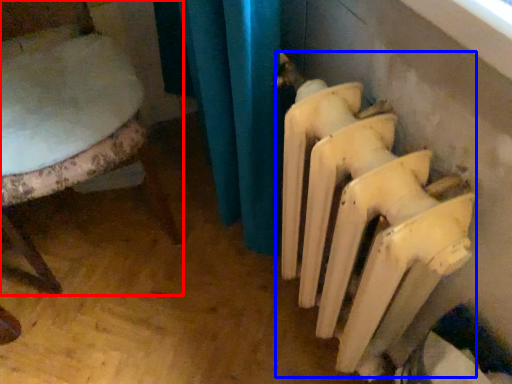
Question: Which point is closer to the camera, chair (highlighted by a red box) or radiator (highlighted by a blue box)?

Choices:
 (A) chair
 (B) radiator

Answer: (B)